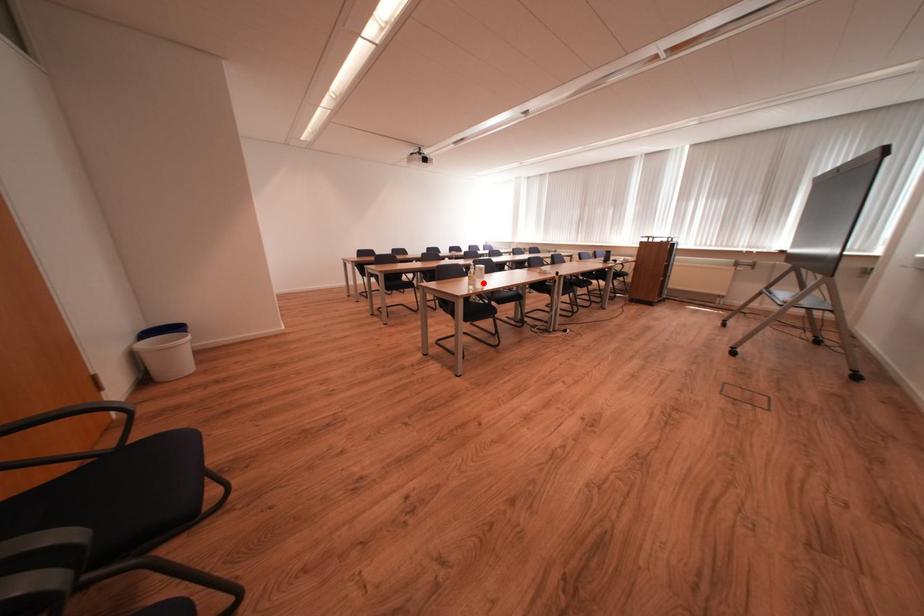
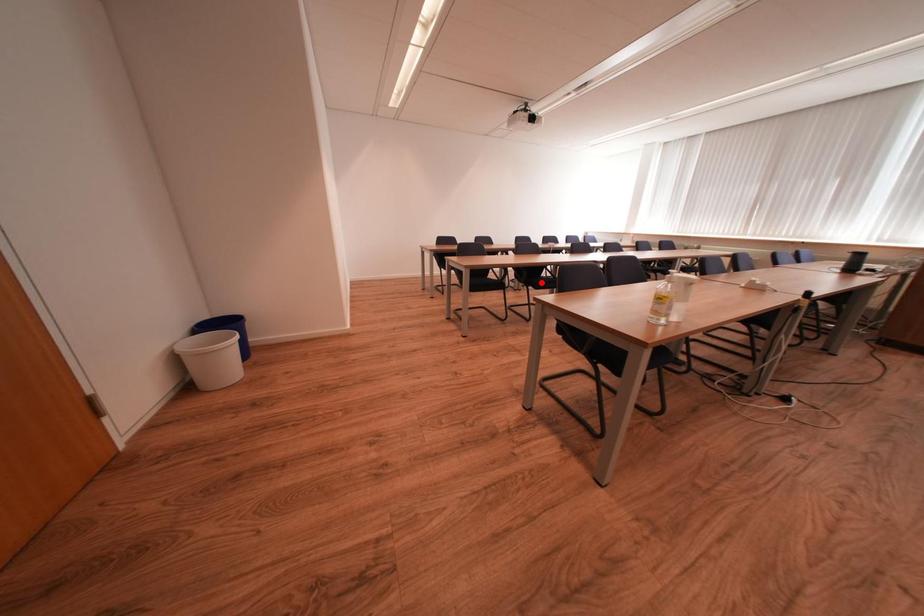
I am providing you with two images of the same scene from different viewpoints. A red point is marked on the first image and another point is marked on the second image. Does the point marked in image1 correspond to the same location as the one in image2?

No